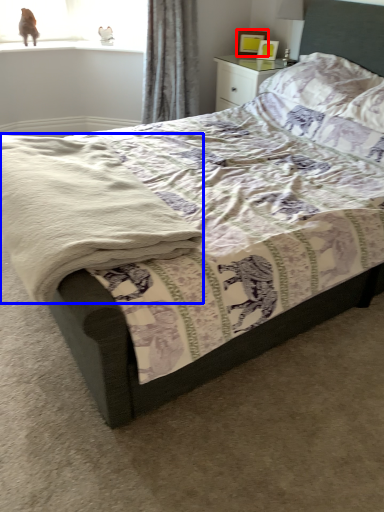
Question: Which point is closer to the camera, picture frame (highlighted by a red box) or material (highlighted by a blue box)?

Choices:
 (A) picture frame
 (B) material

Answer: (B)